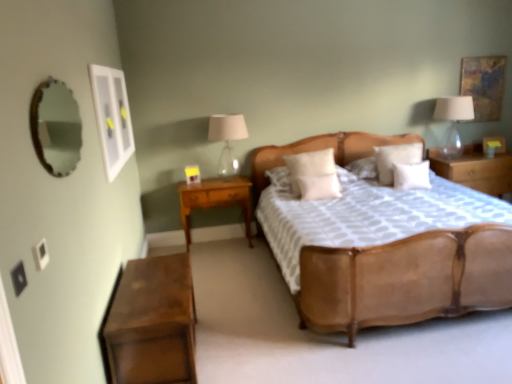
Locate an element on the screen. This screenshot has width=512, height=384. free spot in front of light wood/wooden nightstand at lower left, the second nightstand when ordered from right to left is located at coordinates (224, 263).